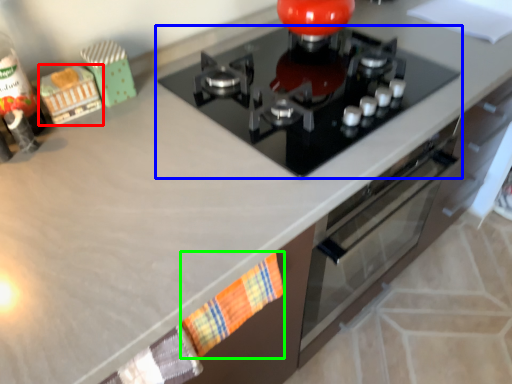
Question: Which is farther away from toy (highlighted by a red box)? gas stove (highlighted by a blue box) or hand towel (highlighted by a green box)?

Choices:
 (A) gas stove
 (B) hand towel

Answer: (B)